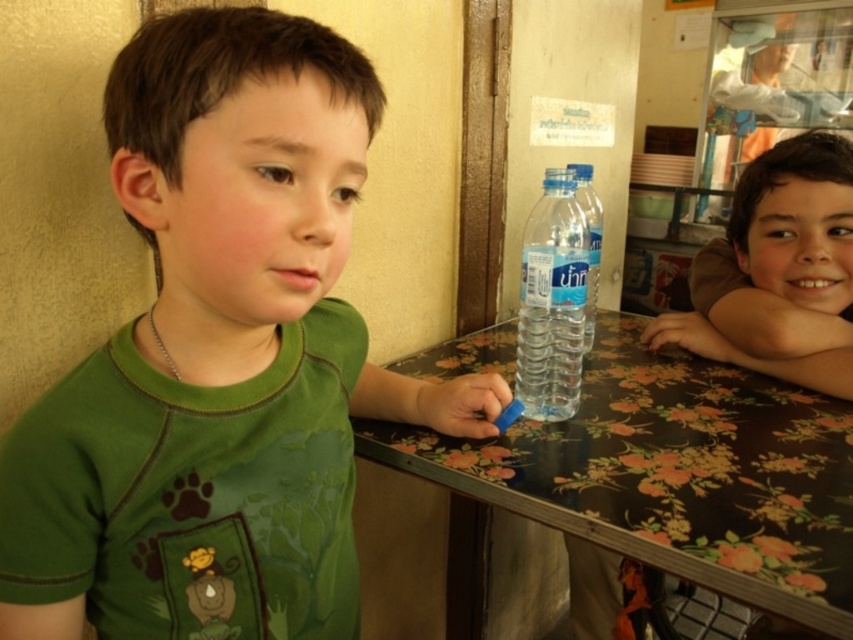
You are a photographer trying to capture both the brown matte face at upper right and the translucent plastic bottle at center in a single shot. Given that the camera can only focus on objects within a 1.2 meter height range, will both subjects be in focus?

The brown matte face at upper right is taller than the translucent plastic bottle at center. Since the height difference between them is not specified, but the camera requires both to be within a 1.2 meter height range to be in focus, it is uncertain if they will both be in focus without knowing their exact heights.